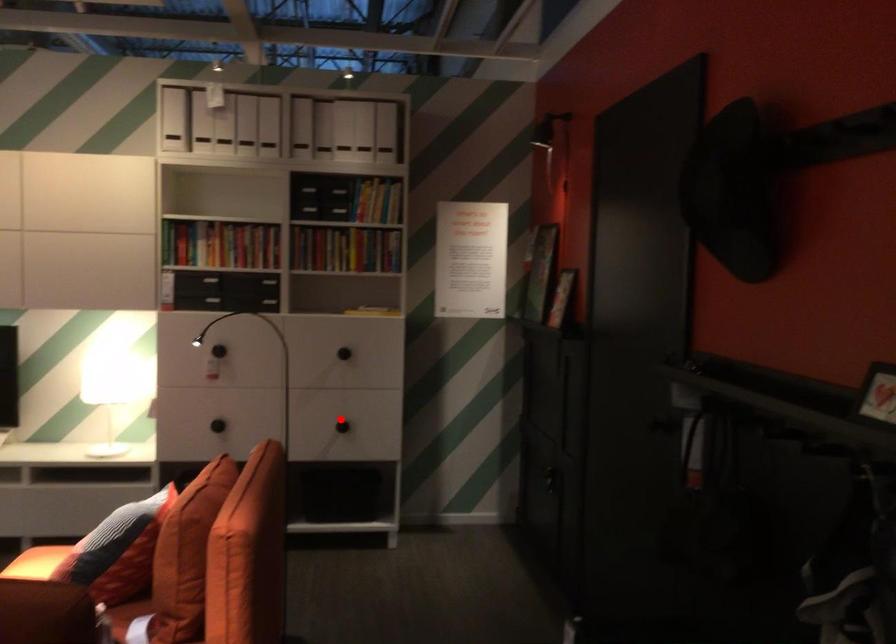
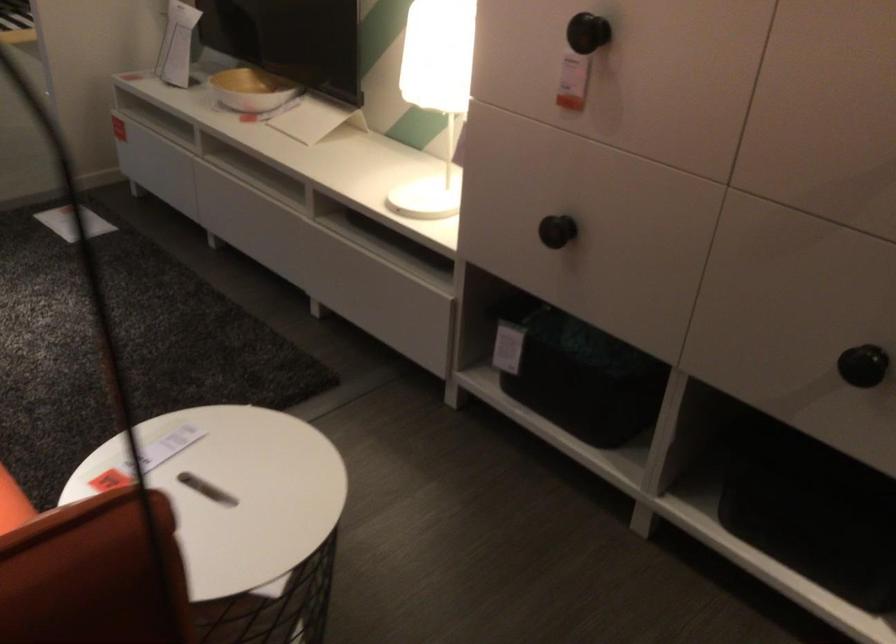
Locate, in the second image, the point that corresponds to the highlighted location in the first image.

(863, 365)